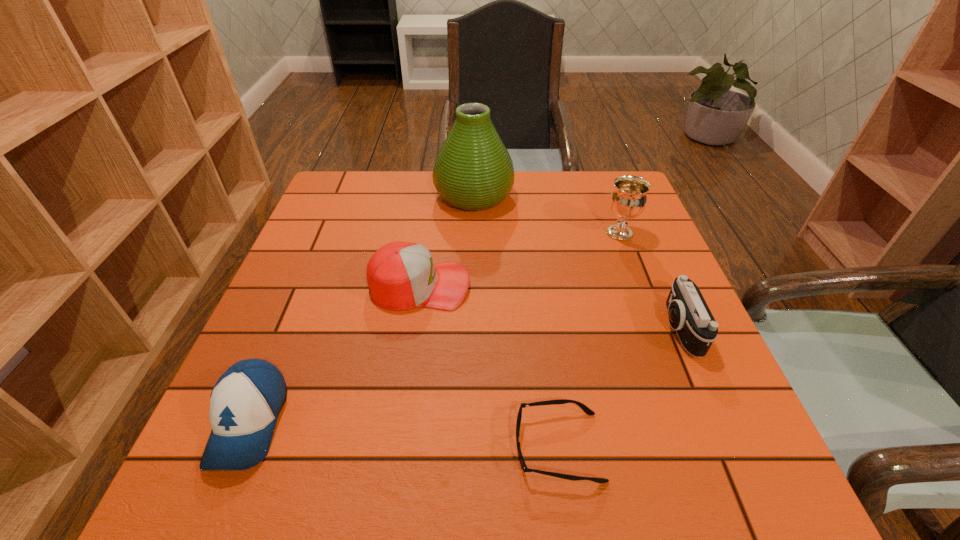
Locate an element on the screen. This screenshot has height=540, width=960. object that stands as the second closest to the nearer baseball cap is located at coordinates (587, 410).

I want to click on object that is the nearest to the shortest object, so click(689, 315).